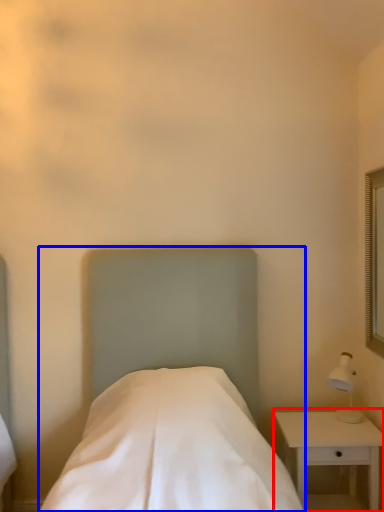
Question: Which point is closer to the camera, nightstand (highlighted by a red box) or bed (highlighted by a blue box)?

Choices:
 (A) nightstand
 (B) bed

Answer: (B)